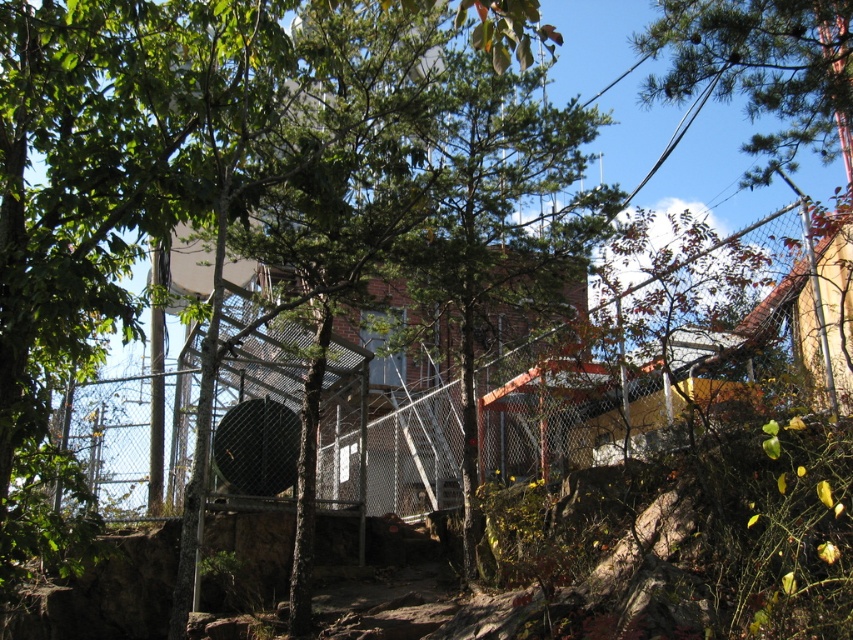
Question: Where is green pine tree at upper right located in relation to black matte basketball hoop at center in the image?

Choices:
 (A) below
 (B) above

Answer: (B)

Question: Which is farther from the black matte basketball hoop at center?

Choices:
 (A) green leafy tree at center
 (B) green pine tree at upper right

Answer: (B)

Question: Does metal chain-link fence at center appear under black matte basketball hoop at center?

Choices:
 (A) yes
 (B) no

Answer: (B)

Question: Which is farther from the black matte basketball hoop at center?

Choices:
 (A) green leafy tree at center
 (B) green pine tree at upper right
 (C) metal chain-link fence at center

Answer: (B)

Question: Which is nearer to the green pine tree at upper right?

Choices:
 (A) black matte basketball hoop at center
 (B) green leafy tree at center

Answer: (B)

Question: Does metal chain-link fence at center appear on the left side of black matte basketball hoop at center?

Choices:
 (A) yes
 (B) no

Answer: (B)